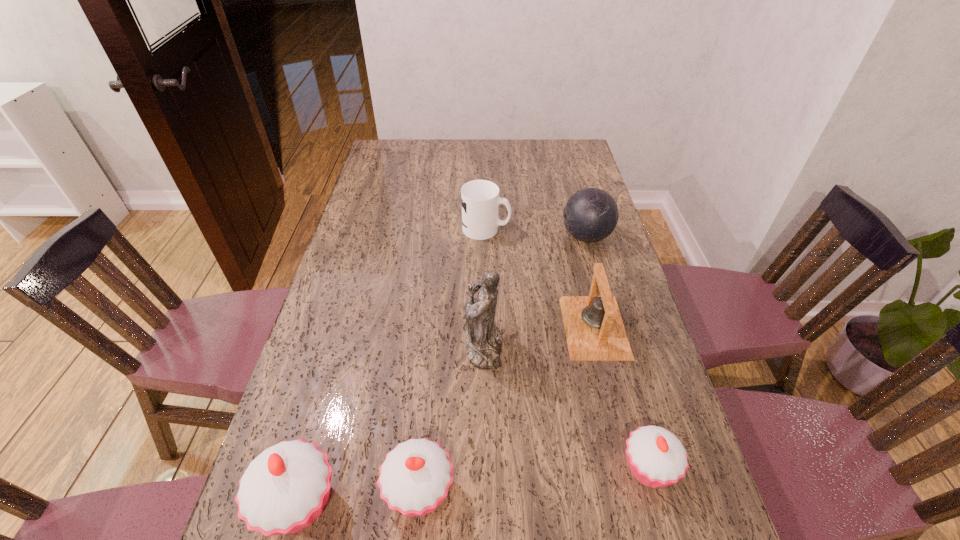
Identify the location of vacant point located between the mug and the second cupcake from right to left. (453, 360).

Locate an element on the screen. The height and width of the screenshot is (540, 960). empty space between the rightmost cupcake and the tallest object is located at coordinates (566, 407).

Choose which object is the third nearest neighbor to the second cupcake from left to right. Please provide its 2D coordinates. Your answer should be formatted as a tuple, i.e. [(x, y)], where the tuple contains the x and y coordinates of a point satisfying the conditions above.

[(656, 457)]

The height and width of the screenshot is (540, 960). Find the location of `the sixth closest object to the tallest object`. the sixth closest object to the tallest object is located at coordinates (480, 199).

Where is `cupcake that is the closest to the bowling ball`? The width and height of the screenshot is (960, 540). cupcake that is the closest to the bowling ball is located at coordinates (656, 457).

This screenshot has height=540, width=960. What are the coordinates of `cupcake that stands as the second closest to the second cupcake from left to right` in the screenshot? It's located at (656, 457).

Locate an element on the screen. The width and height of the screenshot is (960, 540). free space in the image that satisfies the following two spatial constraints: 1. on the back side of the shortest cupcake; 2. on the right side of the second cupcake from left to right is located at coordinates (421, 468).

Locate an element on the screen. This screenshot has height=540, width=960. free space that satisfies the following two spatial constraints: 1. on the back side of the second cupcake from left to right; 2. on the right side of the bell is located at coordinates (435, 327).